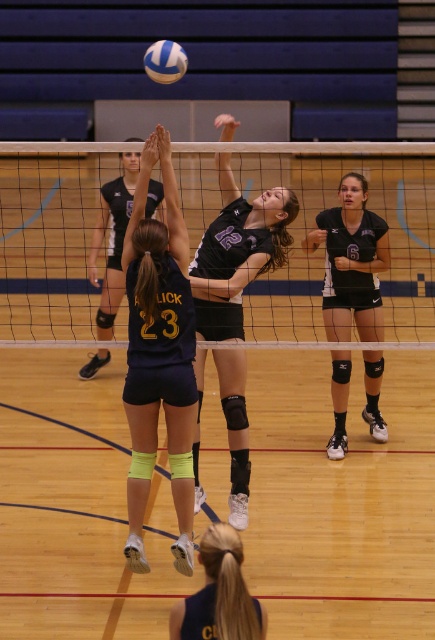
You are a referee watching the volleyball game. You need to determine if the black jersey at center is closer to you than the white matte volleyball at upper center. Based on the scene, what is your observation?

The black jersey at center is further to the viewer than white matte volleyball at upper center, so the black jersey at center is closer to you than the white matte volleyball at upper center.

What are the coordinates of the matte black jersey at center?

The matte black jersey at center is located at point (237, 252).

You are a referee in the volleyball game and need to determine which player is closer to the net. You observe the matte black jersey at center and the dark blue jersey at lower center. Which player is positioned closer to the net?

The matte black jersey at center is closer to the net because it is further to the viewer than the dark blue jersey at lower center.